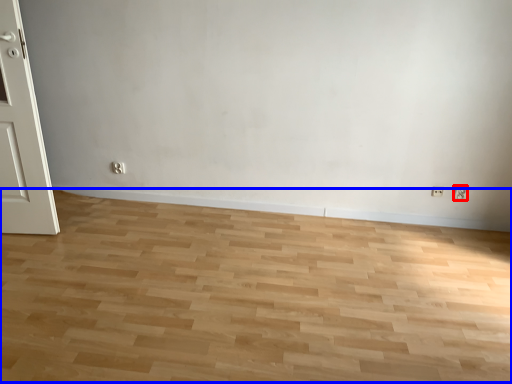
Question: Which object is further to the camera taking this photo, electric outlet (highlighted by a red box) or plain (highlighted by a blue box)?

Choices:
 (A) electric outlet
 (B) plain

Answer: (A)